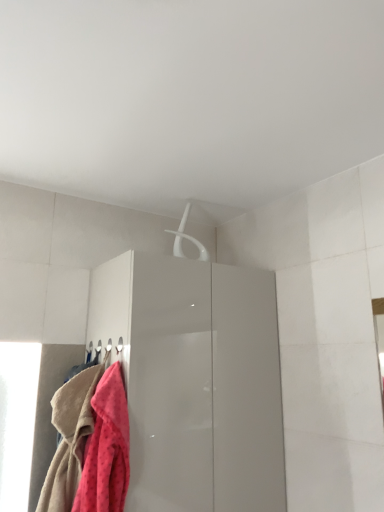
Question: From a real-world perspective, is white plastic hanger at upper center positioned above or below fluffy pink towel at lower left, which appears as the 2th towel when viewed from the left?

Choices:
 (A) above
 (B) below

Answer: (A)

Question: Is white plastic hanger at upper center wider or thinner than fluffy pink towel at lower left, which appears as the 2th towel when viewed from the left?

Choices:
 (A) wide
 (B) thin

Answer: (B)

Question: Which of these objects is positioned closest to the white plastic hanger at upper center?

Choices:
 (A) glossy white cabinet at center
 (B) fluffy pink towel at lower left, arranged as the 1th towel when viewed from the left
 (C) fluffy pink towel at lower left, which appears as the 2th towel when viewed from the left

Answer: (A)

Question: Estimate the real-world distances between objects in this image. Which object is farther from the glossy white cabinet at center?

Choices:
 (A) white plastic hanger at upper center
 (B) fluffy pink towel at lower left, the first towel from the right
 (C) fluffy pink towel at lower left, arranged as the 1th towel when viewed from the left

Answer: (A)